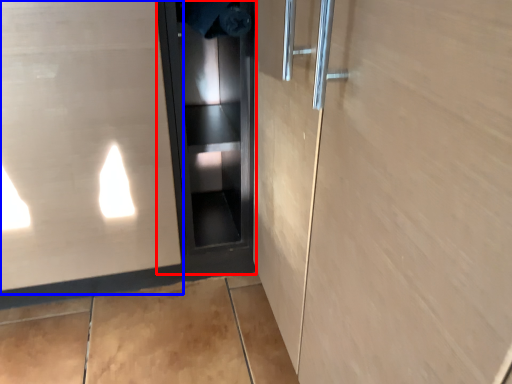
Question: Which of the following is the farthest to the observer, elevator door (highlighted by a red box) or elevator door (highlighted by a blue box)?

Choices:
 (A) elevator door
 (B) elevator door

Answer: (A)